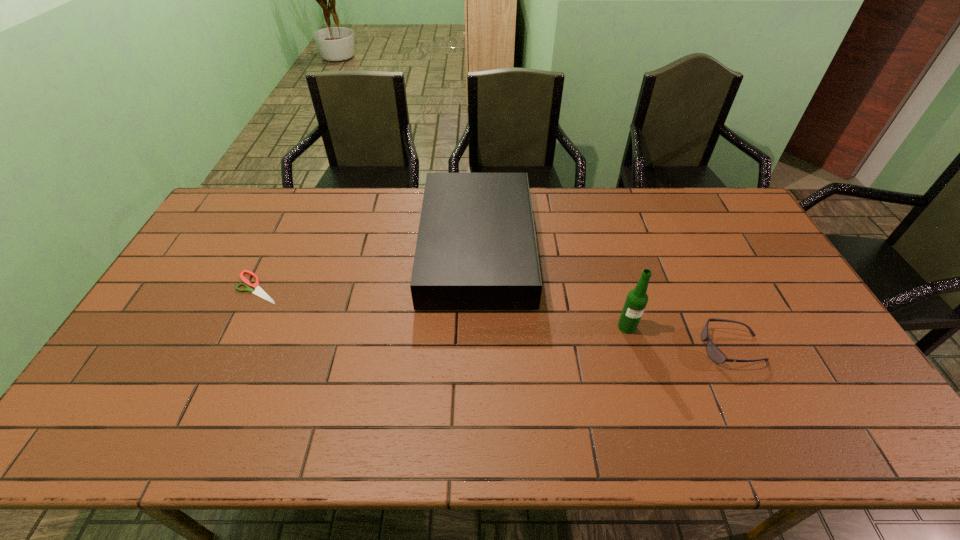
This screenshot has width=960, height=540. Identify the location of the second object from right to left. (636, 301).

What are the coordinates of `the tallest object` in the screenshot? It's located at (636, 301).

The image size is (960, 540). Find the location of `CD player`. CD player is located at coordinates (476, 249).

Find the location of a particular element. The height and width of the screenshot is (540, 960). the second tallest object is located at coordinates 476,249.

Locate an element on the screen. sunglasses is located at coordinates (714, 353).

The image size is (960, 540). Find the location of `the third tallest object`. the third tallest object is located at coordinates (714, 353).

Find the location of a particular element. The height and width of the screenshot is (540, 960). the shortest object is located at coordinates click(x=259, y=291).

Where is `scissors`? This screenshot has width=960, height=540. scissors is located at coordinates (259, 291).

Identify the location of free space located 0.150m on the label of the tallest object. The height and width of the screenshot is (540, 960). (643, 382).

Image resolution: width=960 pixels, height=540 pixels. Identify the location of free space located at the front of the second tallest object for disc insertion. (567, 248).